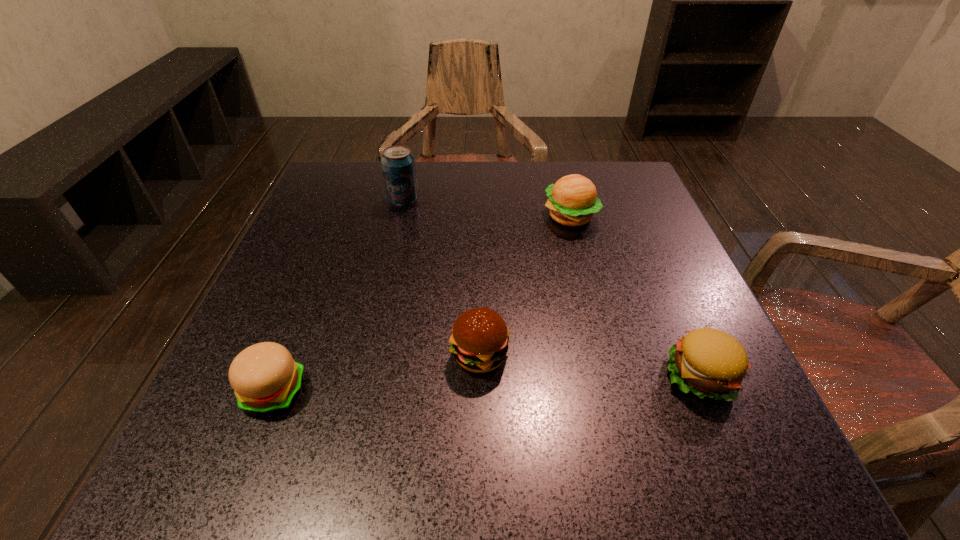
You are a GUI agent. You are given a task and a screenshot of the screen. Output one action in this format:
    pyautogui.click(x=<x>, y=<y>)
    Task: Click on the vacant region located on the back of the leftmost object
    
    Given the screenshot: What is the action you would take?
    293,342

Find the location of a particular element. This screenshot has width=960, height=540. vacant space located 0.270m on the left of the rightmost hamburger is located at coordinates (488, 375).

Find the location of a particular element. This screenshot has height=540, width=960. pop soda located in the far edge section of the desktop is located at coordinates (398, 164).

Find the location of a particular element. hamburger that is positioned at the far edge is located at coordinates (573, 200).

The width and height of the screenshot is (960, 540). I want to click on object at the left edge, so [x=265, y=378].

At what (x,y) coordinates should I click in order to perform the action: click on object positioned at the far right corner. Please return your answer as a coordinate pair (x, y). Image resolution: width=960 pixels, height=540 pixels. Looking at the image, I should click on (573, 200).

In the image, there is a desktop. At what (x,y) coordinates should I click in order to perform the action: click on free space at the far edge. Please return your answer as a coordinate pair (x, y). This screenshot has height=540, width=960. Looking at the image, I should click on (545, 181).

Locate an element on the screen. The width and height of the screenshot is (960, 540). blank space at the near edge is located at coordinates (404, 435).

In the image, there is a desktop. Find the location of `free space at the left edge`. free space at the left edge is located at coordinates (346, 271).

In the image, there is a desktop. What are the coordinates of `vacant space at the far left corner` in the screenshot? It's located at (348, 173).